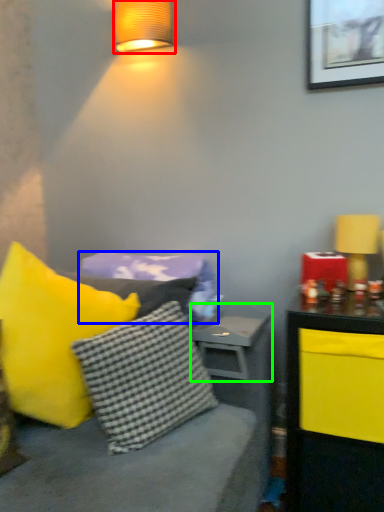
Question: Which is farther away from lamp (highlighted by a red box)? pillow (highlighted by a blue box) or table (highlighted by a green box)?

Choices:
 (A) pillow
 (B) table

Answer: (B)